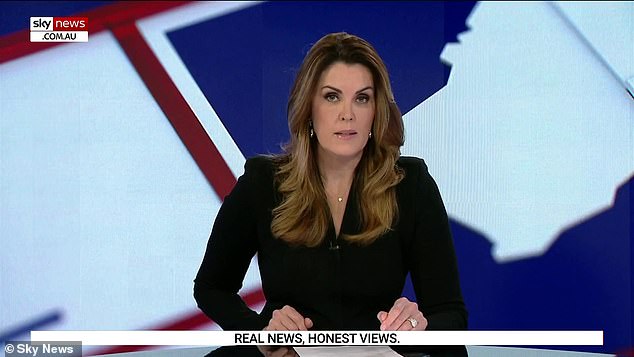
The image size is (634, 357). What are the coordinates of `paper on top of table` in the screenshot? It's located at (320, 352).